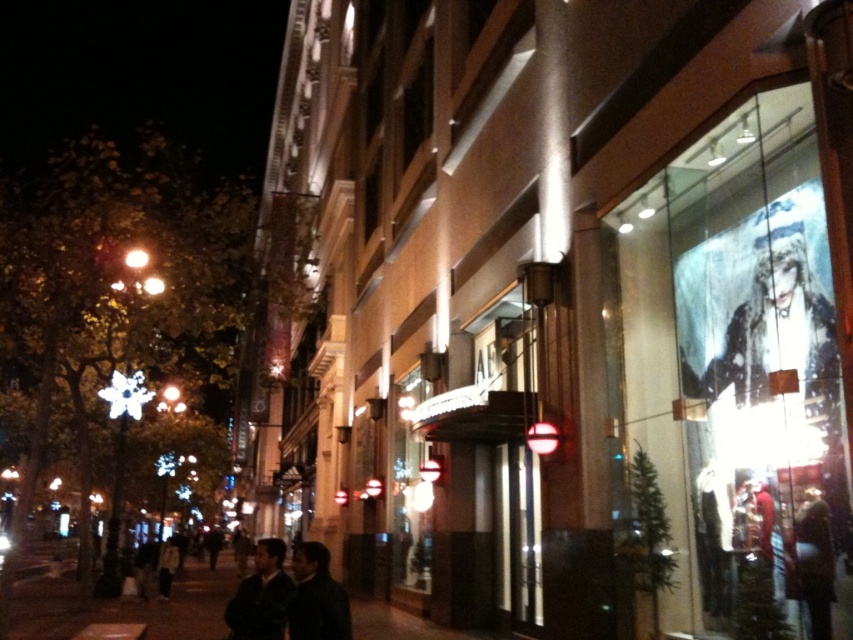
Question: Considering the real-world distances, which object is farthest from the dark asphalt pavement at lower center?

Choices:
 (A) dark gray jacket at center
 (B) dark green leather jackets at center

Answer: (A)

Question: Does dark asphalt pavement at lower center appear under dark gray jacket at center?

Choices:
 (A) no
 (B) yes

Answer: (B)

Question: Does dark asphalt pavement at lower center have a lesser width compared to dark green leather jackets at center?

Choices:
 (A) yes
 (B) no

Answer: (B)

Question: Which object is the farthest from the dark green leather jackets at center?

Choices:
 (A) dark asphalt pavement at lower center
 (B) dark gray jacket at center

Answer: (A)

Question: Is dark asphalt pavement at lower center below dark green leather jackets at center?

Choices:
 (A) yes
 (B) no

Answer: (A)

Question: Which of the following is the closest to the observer?

Choices:
 (A) dark asphalt pavement at lower center
 (B) dark green leather jackets at center
 (C) dark gray jacket at center

Answer: (B)